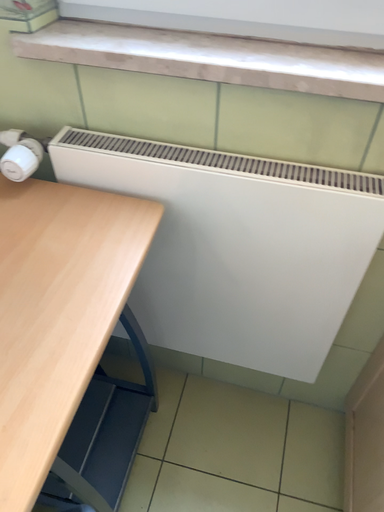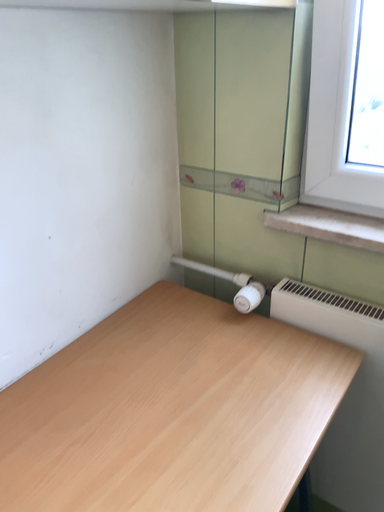
Question: How did the camera likely rotate when shooting the video?

Choices:
 (A) rotated upward
 (B) rotated downward

Answer: (A)